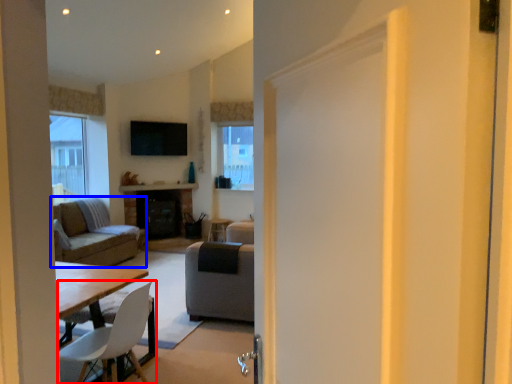
Question: Which object is closer to the camera taking this photo, chair (highlighted by a red box) or studio couch (highlighted by a blue box)?

Choices:
 (A) chair
 (B) studio couch

Answer: (A)